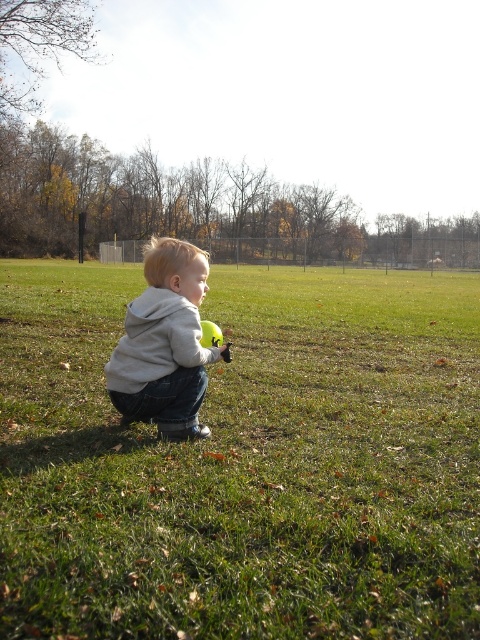
Question: Among these objects, which one is nearest to the camera?

Choices:
 (A) yellow rubber ball at center
 (B) green grassy at center

Answer: (B)

Question: Is green grassy at center to the right of yellow rubber ball at center from the viewer's perspective?

Choices:
 (A) yes
 (B) no

Answer: (A)

Question: Which is nearer to the light gray hoodie at center?

Choices:
 (A) green grassy at center
 (B) yellow rubber ball at center

Answer: (B)

Question: Can you confirm if light gray hoodie at center is wider than yellow rubber ball at center?

Choices:
 (A) yes
 (B) no

Answer: (A)

Question: Is green grassy at center bigger than light gray hoodie at center?

Choices:
 (A) no
 (B) yes

Answer: (B)

Question: Estimate the real-world distances between objects in this image. Which object is closer to the yellow rubber ball at center?

Choices:
 (A) green grassy at center
 (B) light gray hoodie at center

Answer: (B)